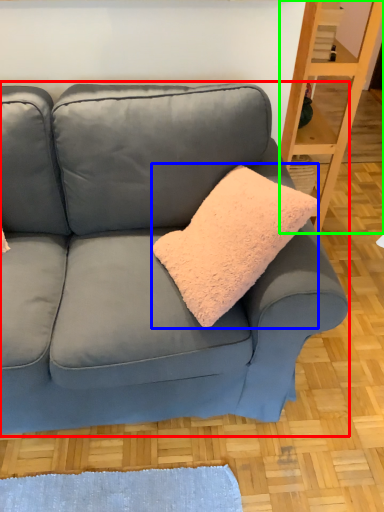
Question: Estimate the real-world distances between objects in this image. Which object is farther from studio couch (highlighted by a red box), throw pillow (highlighted by a blue box) or shelf (highlighted by a green box)?

Choices:
 (A) throw pillow
 (B) shelf

Answer: (B)